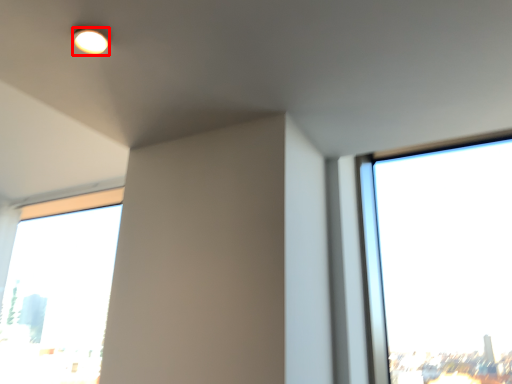
Question: Observing the image, what is the correct spatial positioning of lighting (annotated by the red box) in reference to window?

Choices:
 (A) right
 (B) left

Answer: (A)